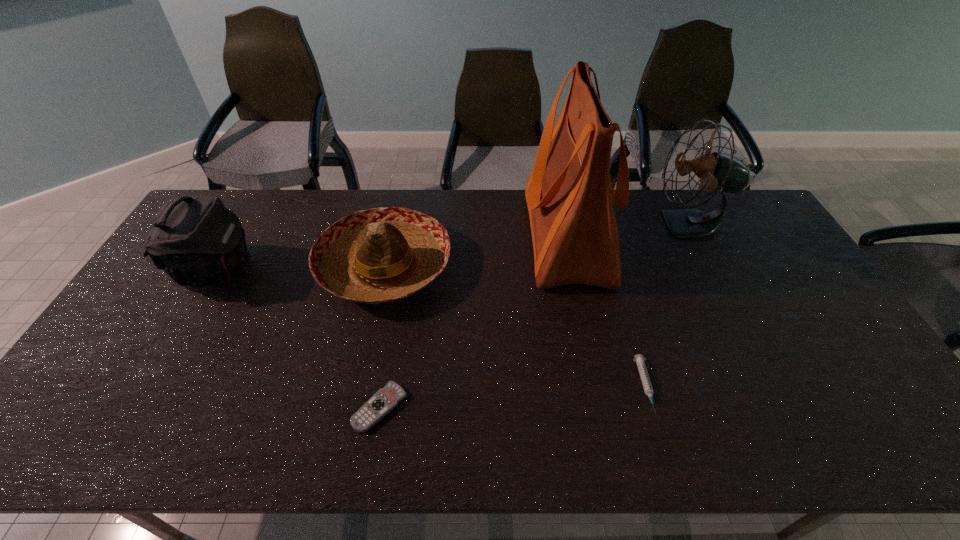
You are a GUI agent. You are given a task and a screenshot of the screen. Output one action in this format:
    pyautogui.click(x=<x>, y=<y>)
    Task: Click on the free space that satisfies the following two spatial constraints: 1. on the open flap of the fourth shortest object; 2. on the back side of the remote control
    The height and width of the screenshot is (540, 960).
    Given the screenshot: What is the action you would take?
    pyautogui.click(x=139, y=407)

Where is `vacant position in the image that satisfies the following two spatial constraints: 1. on the front-facing side of the fifth shortest object for air flow; 2. at the needle end of the second shortest object`? The height and width of the screenshot is (540, 960). vacant position in the image that satisfies the following two spatial constraints: 1. on the front-facing side of the fifth shortest object for air flow; 2. at the needle end of the second shortest object is located at coordinates (772, 387).